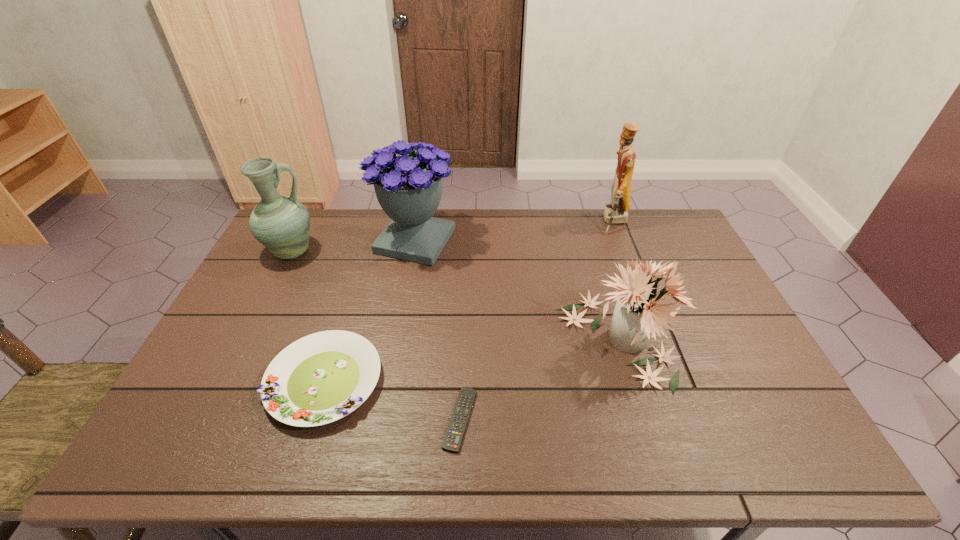
This screenshot has width=960, height=540. I want to click on free location located 0.180m on the front-facing side of the nutcracker, so click(552, 222).

Where is `free space located on the left of the taller bouquet`? This screenshot has width=960, height=540. free space located on the left of the taller bouquet is located at coordinates (300, 241).

The width and height of the screenshot is (960, 540). I want to click on vacant space situated on the handle side of the leftmost object, so click(x=342, y=252).

At what (x,y) coordinates should I click in order to perform the action: click on blank area located on the front of the third shortest object. Please return your answer as a coordinate pair (x, y). This screenshot has height=540, width=960. Looking at the image, I should click on (652, 458).

Where is `vacant region located 0.140m on the left of the salad plate`? The width and height of the screenshot is (960, 540). vacant region located 0.140m on the left of the salad plate is located at coordinates (213, 381).

The width and height of the screenshot is (960, 540). I want to click on vacant point located 0.400m on the left of the remote control, so click(276, 419).

This screenshot has height=540, width=960. In order to click on nutcracker that is at the far edge in this screenshot , I will do `click(616, 212)`.

Locate an element on the screen. The width and height of the screenshot is (960, 540). bouquet located in the far edge section of the desktop is located at coordinates (408, 188).

Where is `pitcher at the far edge`? This screenshot has height=540, width=960. pitcher at the far edge is located at coordinates (281, 223).

Locate an element on the screen. The height and width of the screenshot is (540, 960). salad plate at the near edge is located at coordinates (320, 378).